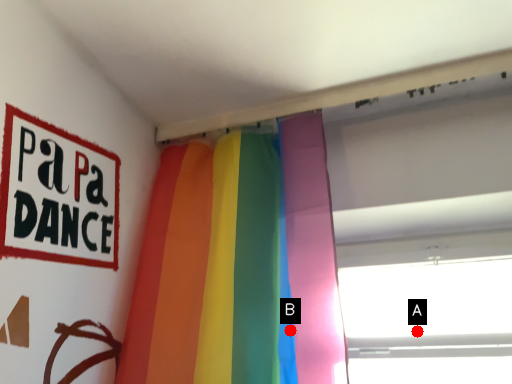
Question: Two points are circled on the image, labeled by A and B beside each circle. Which point is closer to the camera?

Choices:
 (A) A is closer
 (B) B is closer

Answer: (B)